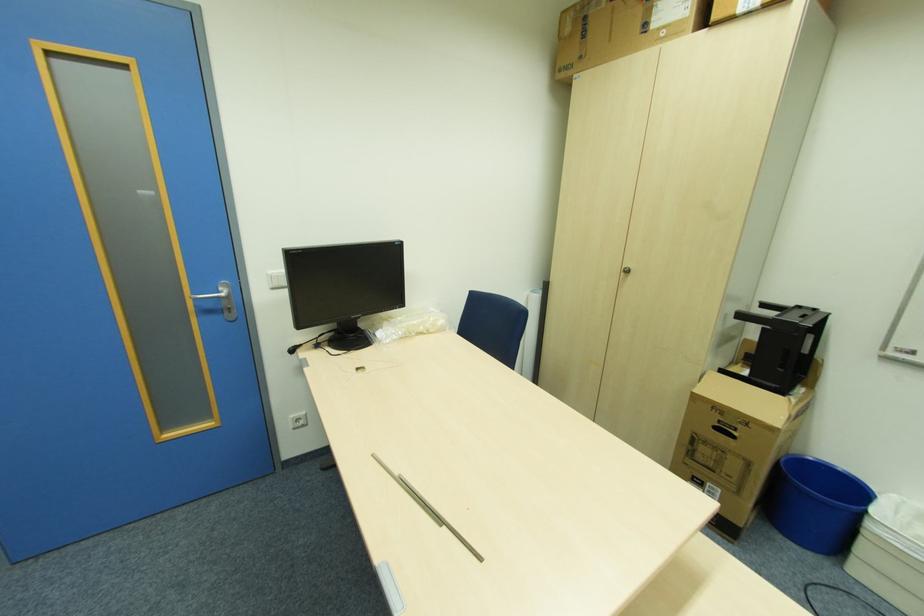
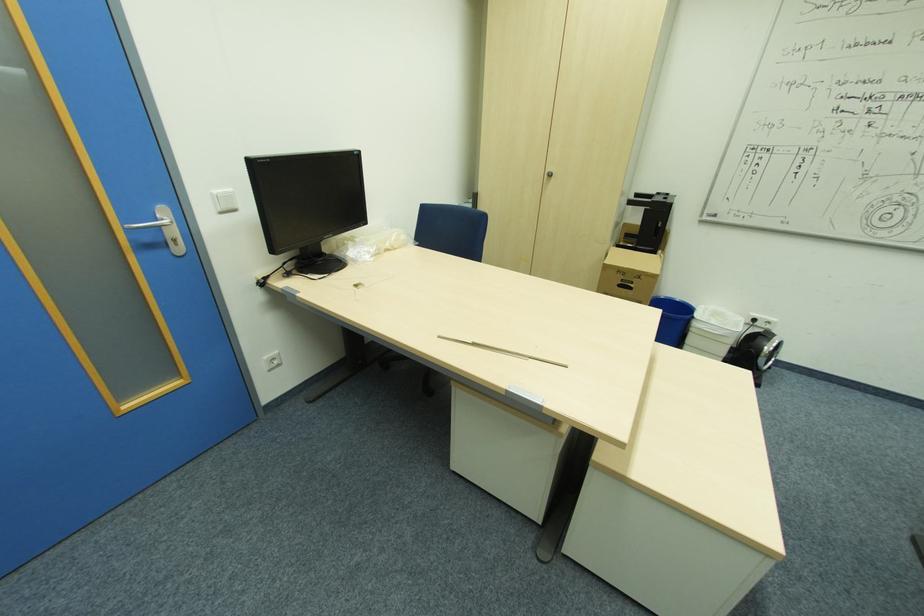
In the second image, find the point that corresponds to (843,469) in the first image.

(678, 300)